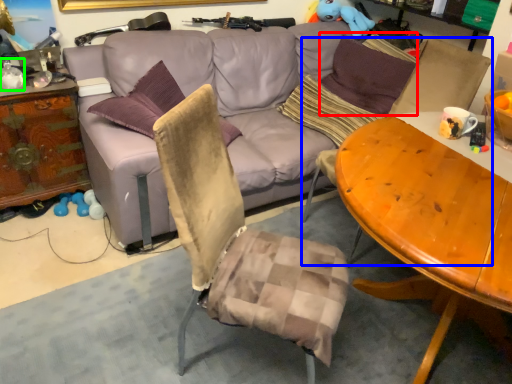
Question: Which object is the closest to the pillow (highlighted by a red box)? Choose among these: swivel chair (highlighted by a blue box) or bottle (highlighted by a green box).

Choices:
 (A) swivel chair
 (B) bottle

Answer: (A)